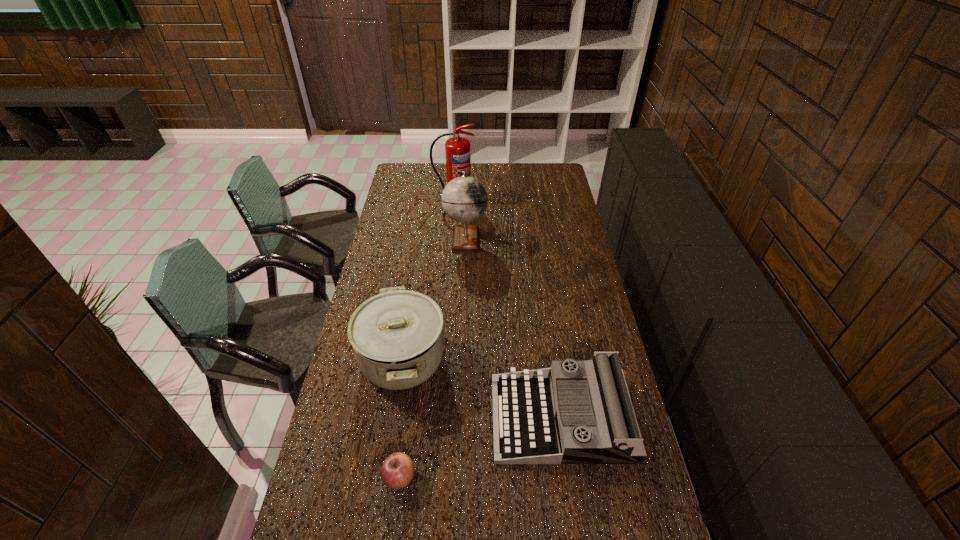
Image resolution: width=960 pixels, height=540 pixels. I want to click on free space at the far left corner, so click(407, 167).

Locate an element on the screen. This screenshot has height=540, width=960. vacant space at the far right corner of the desktop is located at coordinates (552, 164).

This screenshot has height=540, width=960. I want to click on unoccupied area between the saucepan and the fire extinguisher, so click(428, 279).

Where is `empty space that is in between the second shortest object and the third shortest object`? The width and height of the screenshot is (960, 540). empty space that is in between the second shortest object and the third shortest object is located at coordinates (482, 388).

In order to click on free spot between the second farthest object and the saucepan in this screenshot , I will do `click(434, 299)`.

At what (x,y) coordinates should I click in order to perform the action: click on the fourth closest object to the rightmost object. Please return your answer as a coordinate pair (x, y). This screenshot has width=960, height=540. Looking at the image, I should click on (457, 149).

You are a GUI agent. You are given a task and a screenshot of the screen. Output one action in this format:
    pyautogui.click(x=<x>, y=<y>)
    Task: Click on the object that ranks as the third closest to the apple
    
    Given the screenshot: What is the action you would take?
    pyautogui.click(x=464, y=199)